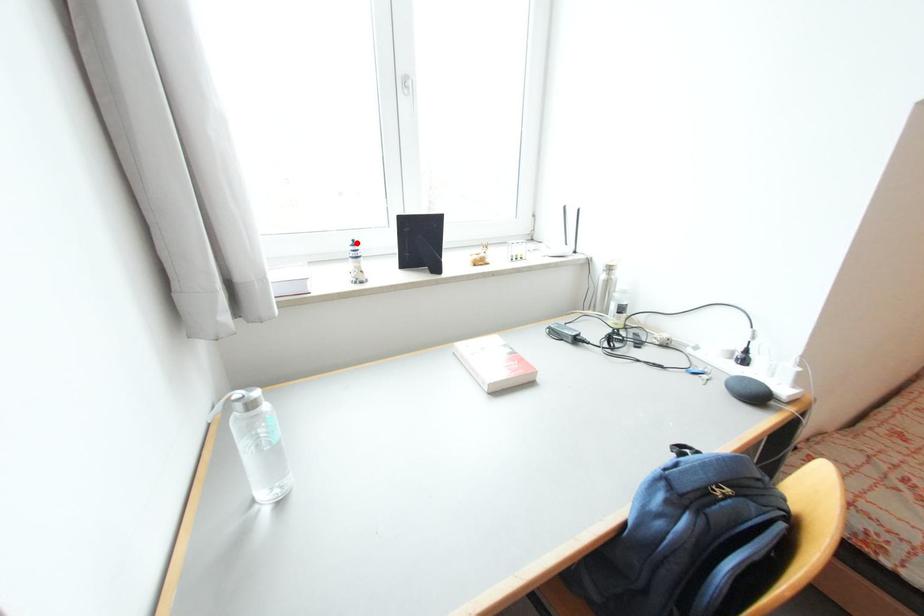
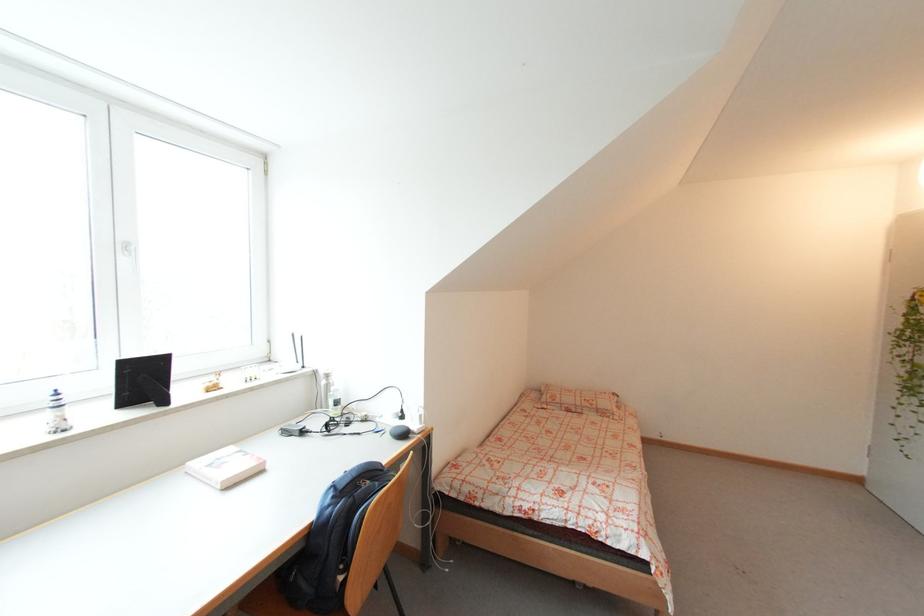
Where in the second image is the point corresponding to the highlighted location from the first image?

(58, 392)